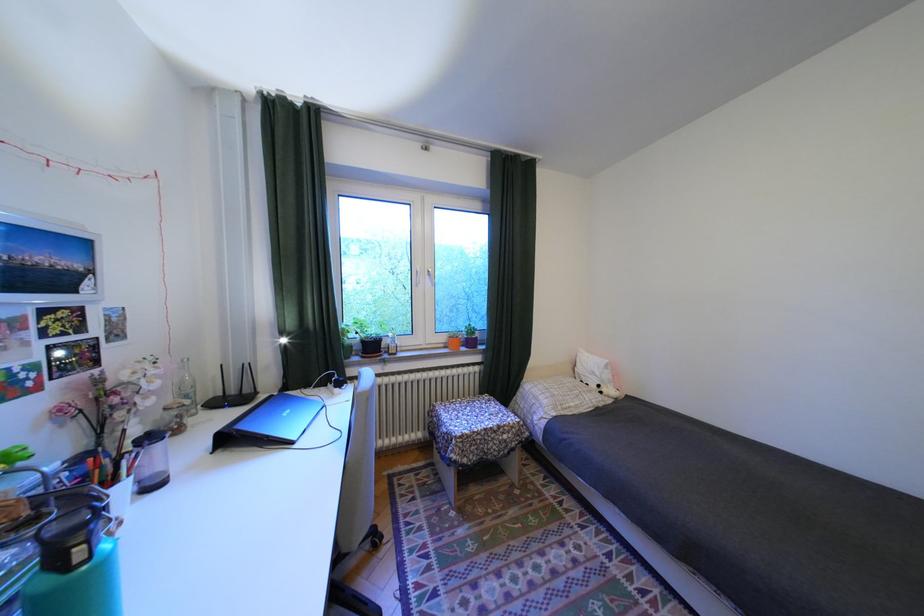
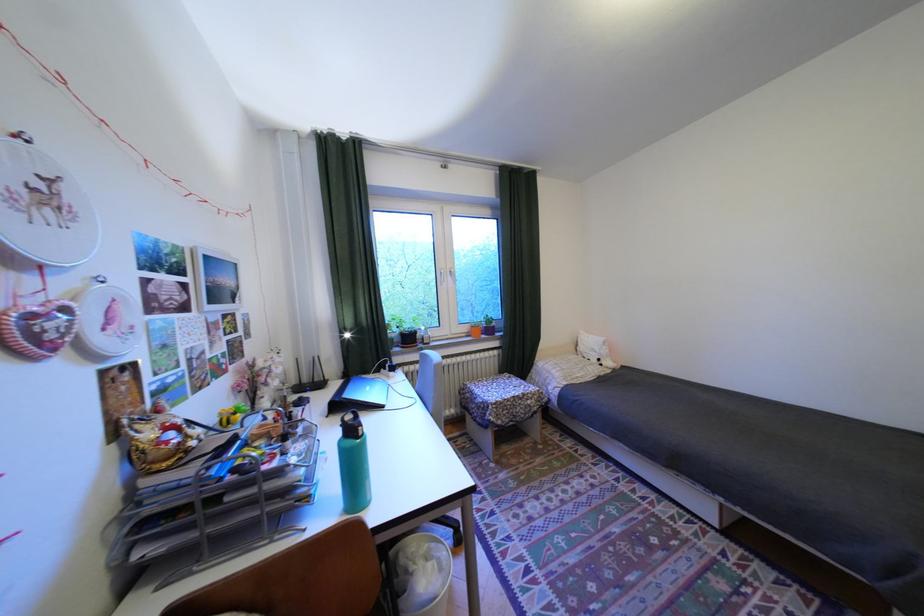
Locate, in the second image, the point that corresponds to (477,461) in the first image.

(512, 422)